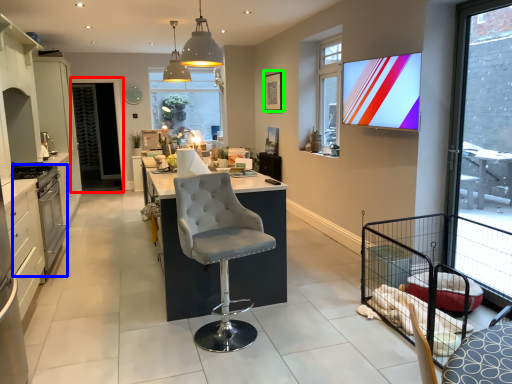
Question: Estimate the real-world distances between objects in this image. Which object is closer to screen door (highlighted by a red box), appliance (highlighted by a blue box) or picture frame (highlighted by a green box)?

Choices:
 (A) appliance
 (B) picture frame

Answer: (B)